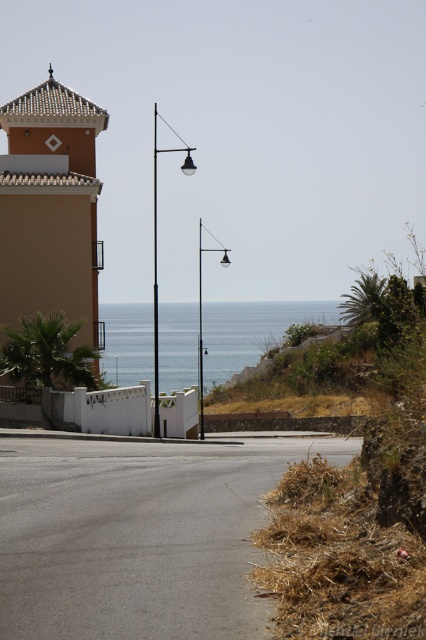
You are a photographer planning to capture the coastal scene. You want to ensure that the matte orange building at upper left and the blue water at center are both visible in your shot. Based on their sizes, which object should you focus on to include both in the frame?

The matte orange building at upper left is thinner than the blue water at center, so focusing on the blue water at center would allow both to fit in the frame since it occupies more horizontal space.

You are standing at the center of the road in the coastal scene. You want to walk towards the matte orange building at upper left. Which direction should you face?

You should face towards the upper left direction to walk towards the matte orange building at upper left, as it is located at point [51,208].